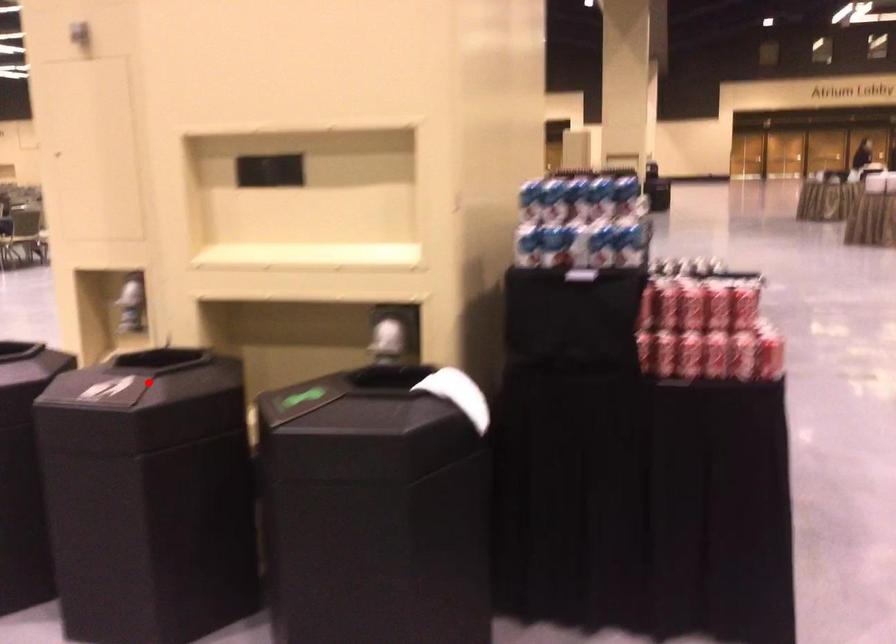
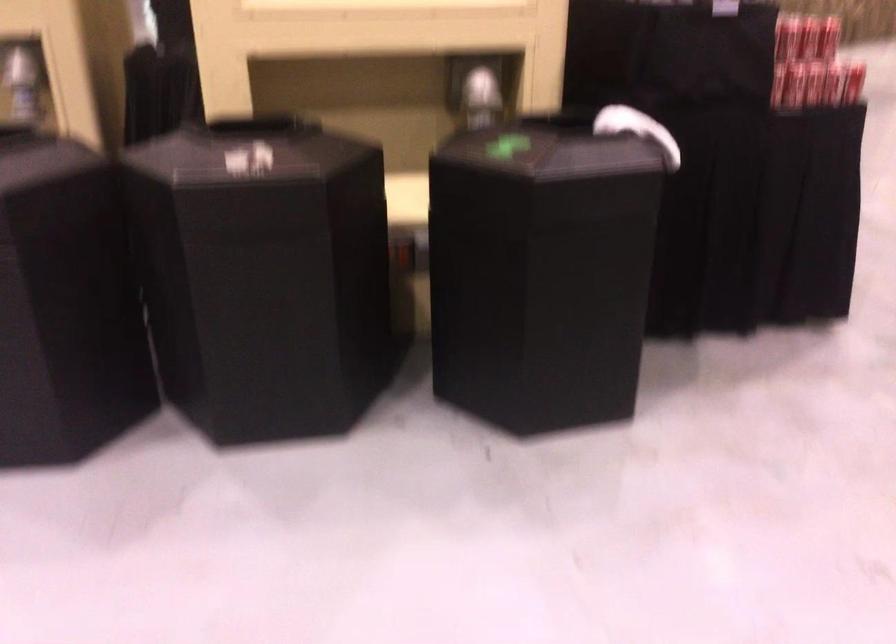
Find the pixel in the second image that matches the highlighted location in the first image.

(271, 154)